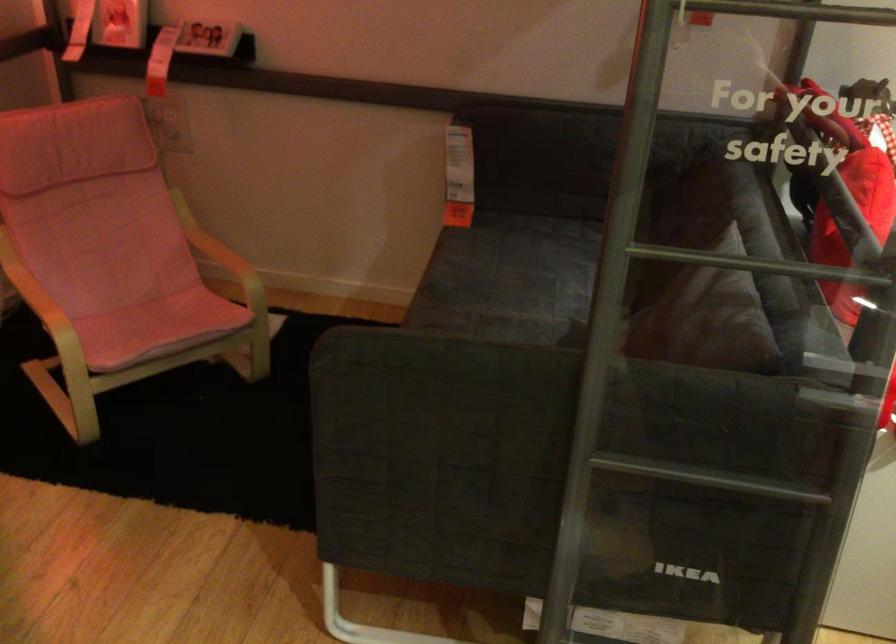
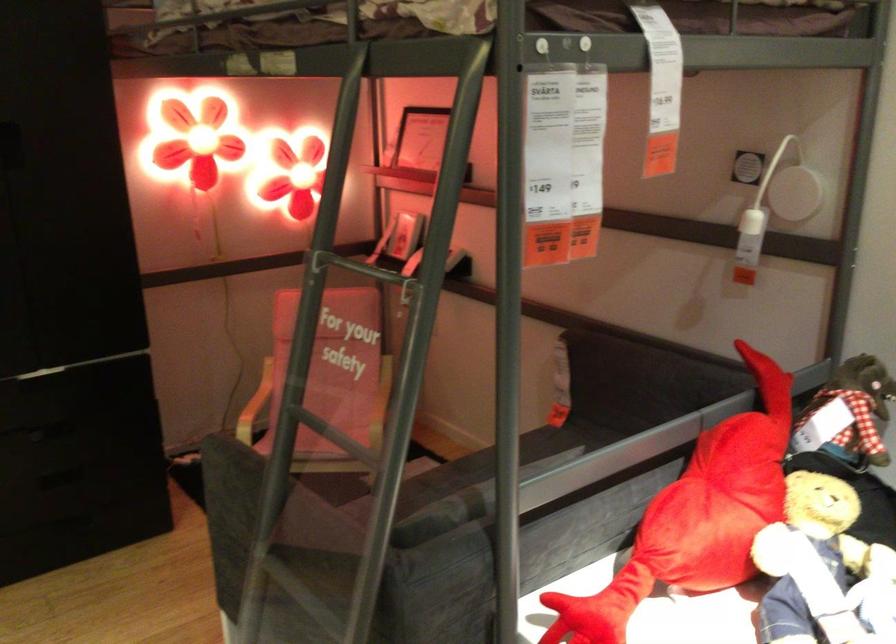
In the second image, find the point that corresponds to point (587, 507) in the first image.

(293, 609)